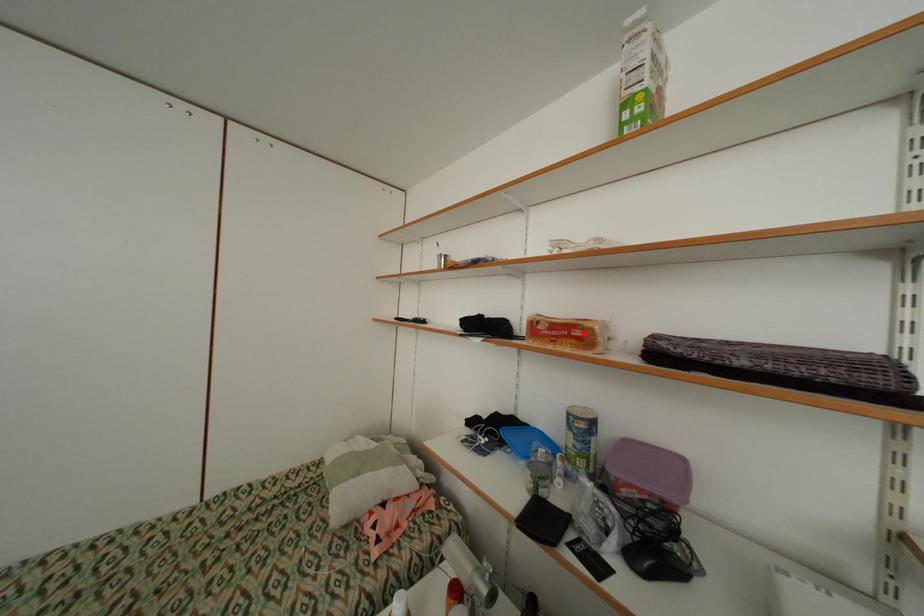
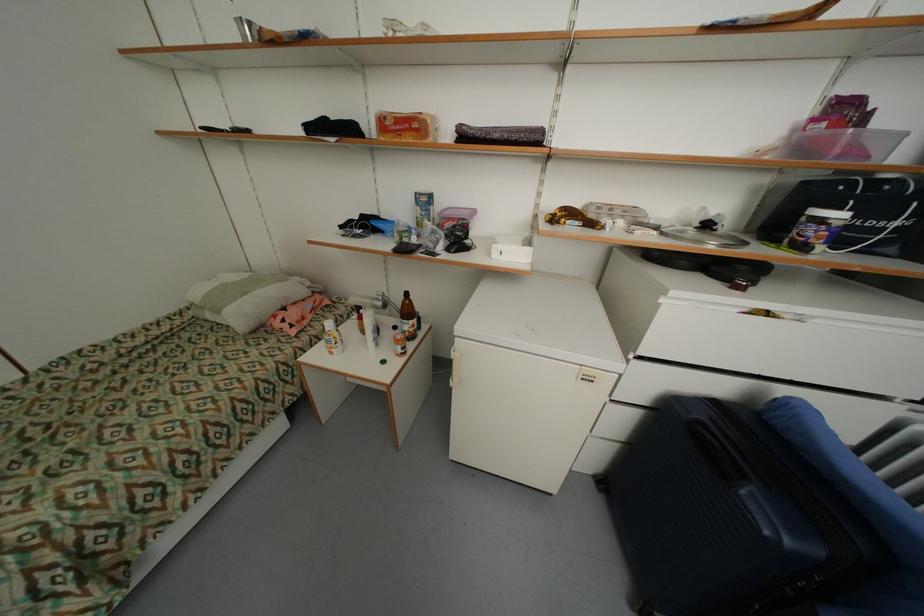
Locate, in the second image, the point that corresponds to the highlighted location in the first image.

(421, 126)